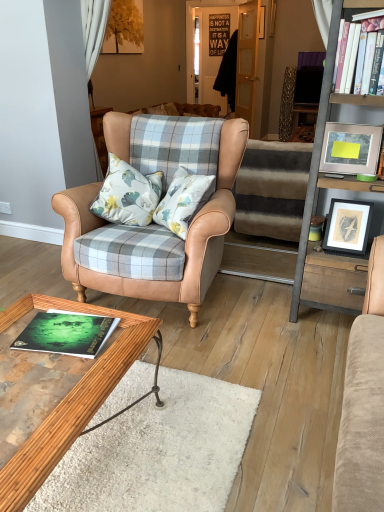
You are a GUI agent. You are given a task and a screenshot of the screen. Output one action in this format:
    pyautogui.click(x=<x>, y=<y>)
    Task: Click on the vacant space in front of green matte book at lower left, the second book when ordered from top to bottom
    
    Given the screenshot: What is the action you would take?
    pyautogui.click(x=56, y=386)